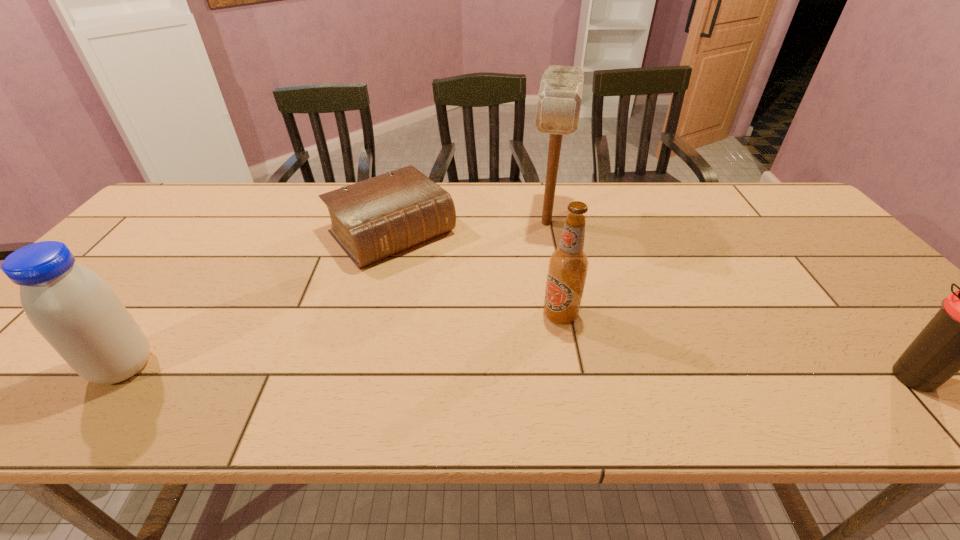
The width and height of the screenshot is (960, 540). Identify the location of vacant space on the desktop that is between the leftmost object and the second shortest object and is positioned on the spine side of the Bible. (529, 373).

I want to click on free space on the desktop that is between the soya milk and the thermos bottle and is positioned on the front label of the third farthest object, so click(431, 372).

Find the location of a particular element. free space on the desktop that is between the leftmost object and the rightmost object and is positioned above the head of the mallet is located at coordinates (523, 373).